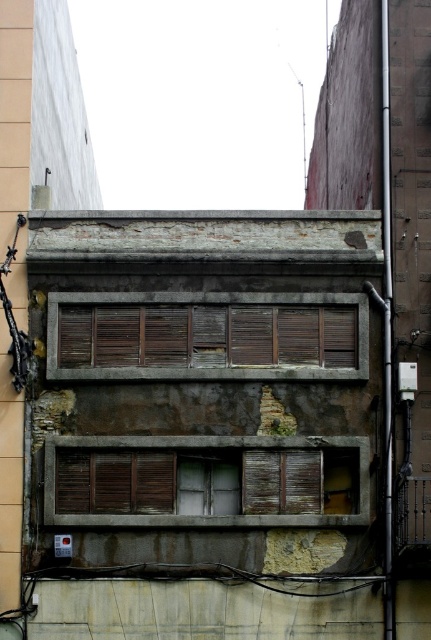
Question: Among these points, which one is farthest from the camera?

Choices:
 (A) (177, 371)
 (B) (69, 515)

Answer: (A)

Question: Which point appears farthest from the camera in this image?

Choices:
 (A) (218, 442)
 (B) (243, 300)

Answer: (B)

Question: Can you confirm if brown wooden shutters at center is thinner than wooden shutters at center?

Choices:
 (A) yes
 (B) no

Answer: (B)

Question: Does brown wooden shutters at center have a smaller size compared to wooden shutters at center?

Choices:
 (A) yes
 (B) no

Answer: (B)

Question: Considering the relative positions of brown wooden shutters at center and wooden shutters at center in the image provided, where is brown wooden shutters at center located with respect to wooden shutters at center?

Choices:
 (A) below
 (B) above

Answer: (B)

Question: Which point appears closest to the camera in this image?

Choices:
 (A) (87, 348)
 (B) (87, 436)

Answer: (B)